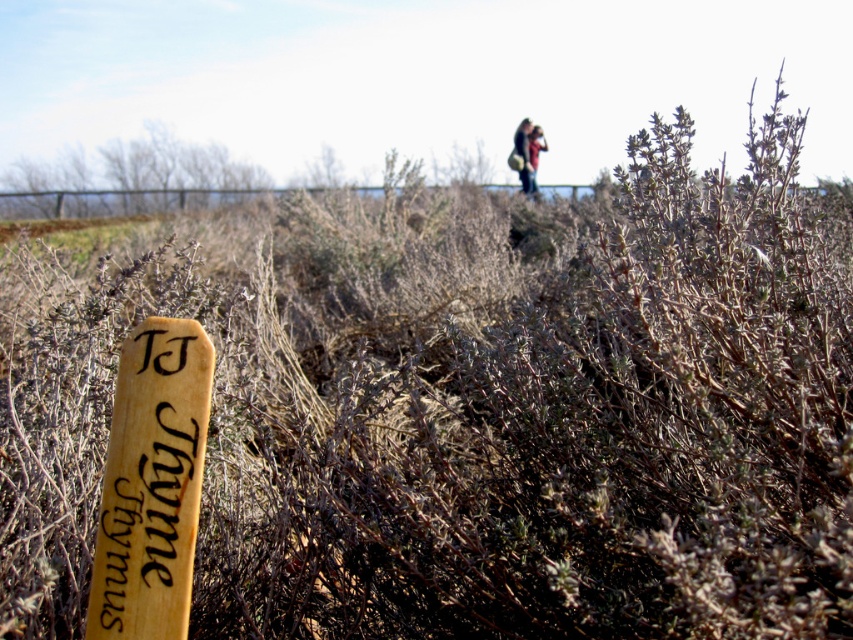
You are a photographer trying to capture the thyme plant in the foreground while also including the dark brown leather jacket at upper center in your shot. Based on their positions, where should you focus your camera to ensure both are in sharp focus?

To ensure both the thyme plant and the dark brown leather jacket at upper center are in sharp focus, you should focus at the hyperfocal distance. This technique maximizes the depth of field, allowing both foreground and background elements to be in focus. Alternatively, you might use a small aperture setting to increase depth of field, ensuring the thyme plant in the foreground and the dark brown leather jacket at upper center are both sharp.